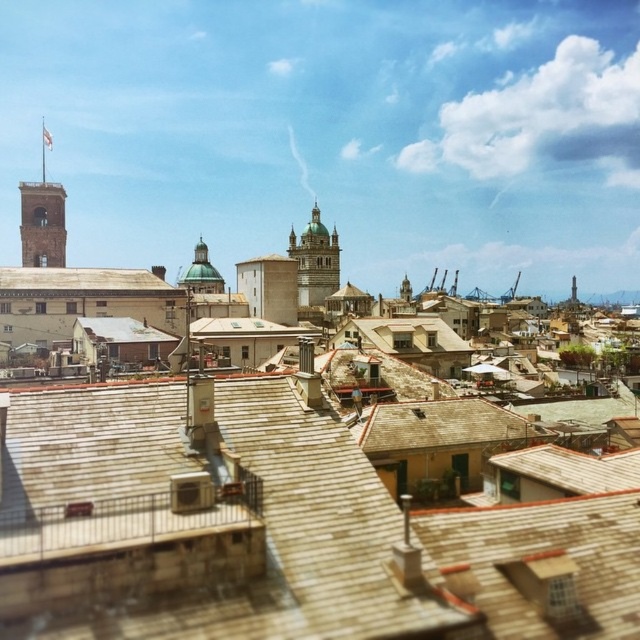
Consider the image. Between brown shingles at center and golden stone bell tower at center, which one is positioned lower?

brown shingles at center is below.

Which is above, brown shingles at center or golden stone bell tower at center?

golden stone bell tower at center is above.

Locate an element on the screen. Image resolution: width=640 pixels, height=640 pixels. brown shingles at center is located at coordinates (81, 280).

In the scene shown: Which is more to the left, brown shingles at center or brick bell tower at left?

From the viewer's perspective, brick bell tower at left appears more on the left side.

Who is more distant from viewer, (x=90, y=269) or (x=35, y=246)?

The point (x=35, y=246) is behind.

Which is behind, point (156, 285) or point (29, 209)?

Positioned behind is point (29, 209).

Locate an element on the screen. This screenshot has height=640, width=640. brown shingles at center is located at coordinates (81, 280).

Does brick bell tower at left come in front of golden stone bell tower at center?

Yes, it is in front of golden stone bell tower at center.

Does brick bell tower at left have a smaller size compared to golden stone bell tower at center?

Indeed, brick bell tower at left has a smaller size compared to golden stone bell tower at center.

Who is more distant from viewer, (51, 208) or (300, 273)?

Positioned behind is point (300, 273).

You are a GUI agent. You are given a task and a screenshot of the screen. Output one action in this format:
    pyautogui.click(x=<x>, y=<y>)
    Task: Click on the brick bell tower at left
    This screenshot has height=640, width=640.
    Given the screenshot: What is the action you would take?
    [42, 225]